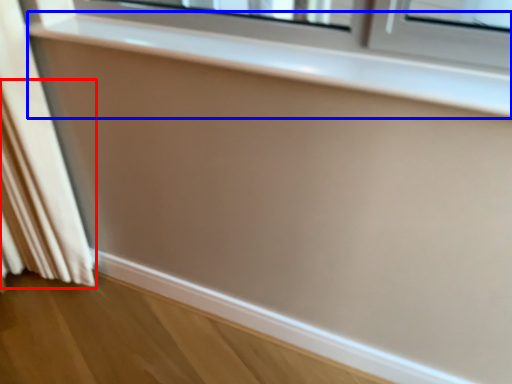
Question: Which point is closer to the camera, curtain (highlighted by a red box) or window sill (highlighted by a blue box)?

Choices:
 (A) curtain
 (B) window sill

Answer: (B)